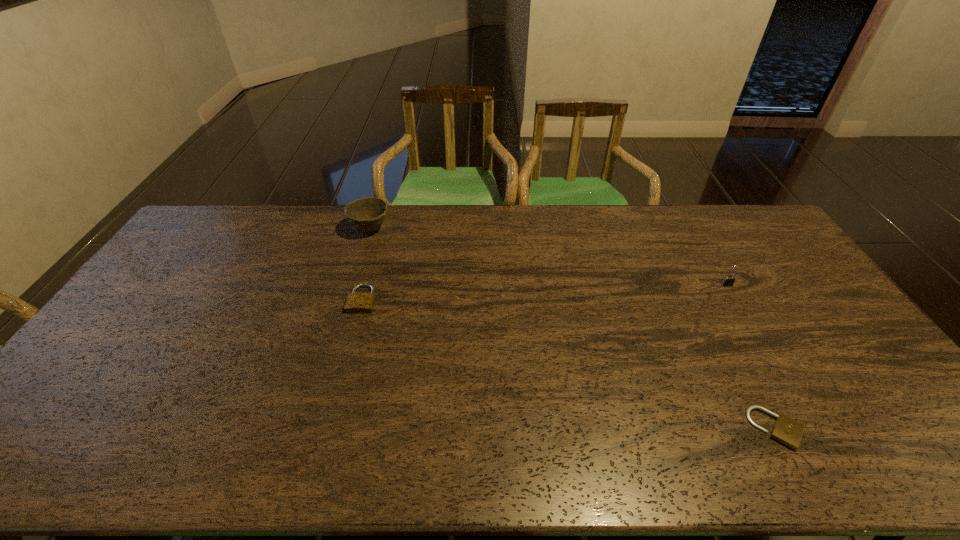
Identify the location of the farthest object. This screenshot has height=540, width=960. (367, 214).

At what (x,y) coordinates should I click in order to perform the action: click on the tallest object. Please return your answer as a coordinate pair (x, y). This screenshot has width=960, height=540. Looking at the image, I should click on (367, 214).

Locate an element on the screen. This screenshot has height=540, width=960. the rightmost object is located at coordinates (728, 280).

Identify the location of the tallest padlock. (728, 280).

At what (x,y) coordinates should I click in order to perform the action: click on the third tallest object. Please return your answer as a coordinate pair (x, y). The image size is (960, 540). Looking at the image, I should click on click(356, 302).

Identify the location of the leftmost padlock. This screenshot has width=960, height=540. (356, 302).

Locate an element on the screen. the shortest object is located at coordinates (787, 431).

You are a GUI agent. You are given a task and a screenshot of the screen. Output one action in this format:
    pyautogui.click(x=<x>, y=<y>)
    Task: Click on the nearest object
    
    Given the screenshot: What is the action you would take?
    pyautogui.click(x=787, y=431)

Locate an element on the screen. The width and height of the screenshot is (960, 540). vacant space located on the right of the bowl is located at coordinates (489, 230).

Locate an element on the screen. The image size is (960, 540). free space located 0.240m on the shackle of the second tallest object is located at coordinates (763, 347).